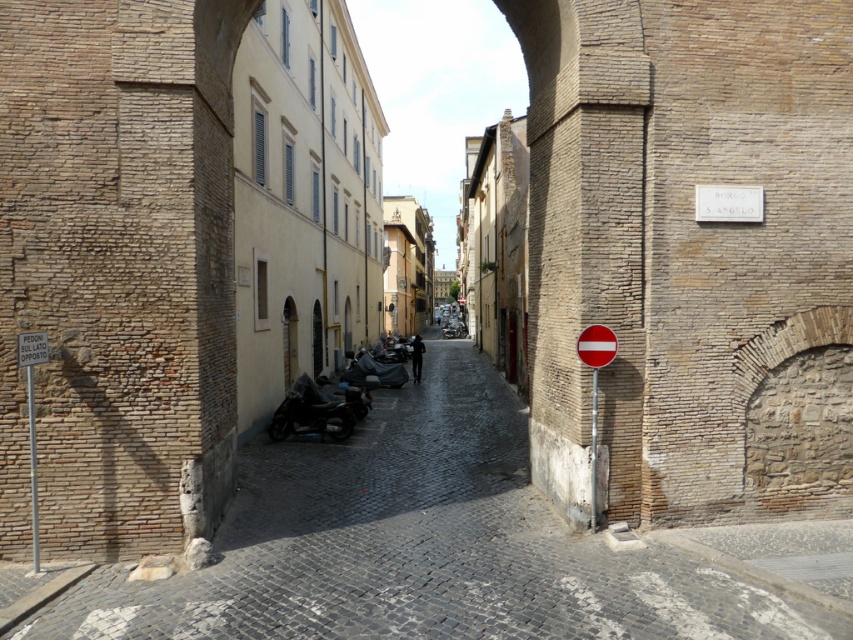
Can you confirm if brick cobblestone alley at center is positioned to the right of red matte sign at right?

Incorrect, brick cobblestone alley at center is not on the right side of red matte sign at right.

Who is more forward, (x=498, y=467) or (x=595, y=365)?

Point (x=595, y=365)

Measure the distance between point (369, 525) and camera.

A distance of 8.65 meters exists between point (369, 525) and camera.

In order to click on brick cobblestone alley at center in this screenshot , I will do `click(419, 545)`.

Is brick cobblestone alley at center below white plastic sign at left?

Yes, brick cobblestone alley at center is below white plastic sign at left.

Which is in front, point (550, 568) or point (21, 337)?

Point (21, 337)

The width and height of the screenshot is (853, 640). Identify the location of brick cobblestone alley at center. (419, 545).

Can you confirm if red matte sign at right is positioned to the right of white plastic sign at left?

Indeed, red matte sign at right is positioned on the right side of white plastic sign at left.

The height and width of the screenshot is (640, 853). What do you see at coordinates (596, 346) in the screenshot?
I see `red matte sign at right` at bounding box center [596, 346].

Between point (605, 362) and point (42, 346), which one is positioned behind?

The point (605, 362) is more distant.

Where is `red matte sign at right`? red matte sign at right is located at coordinates point(596,346).